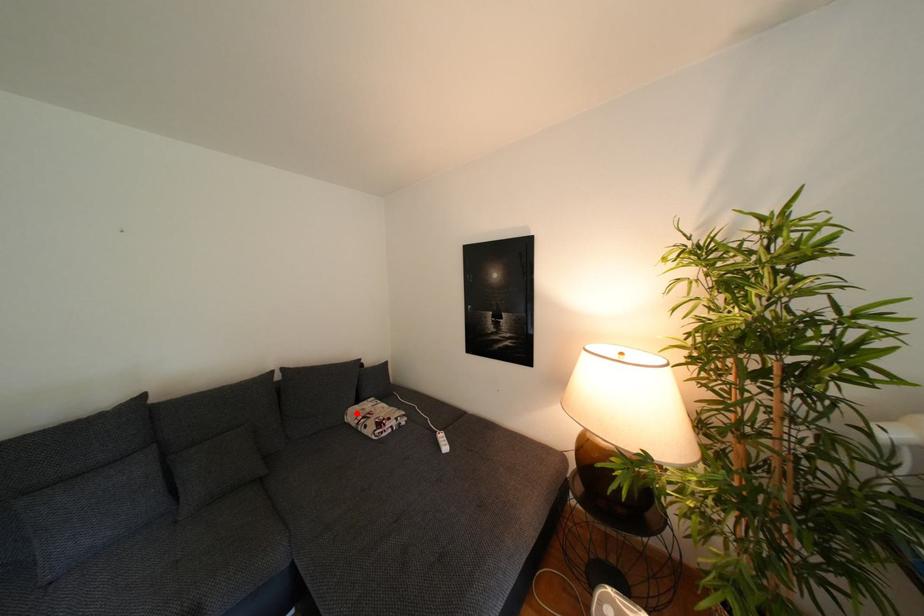
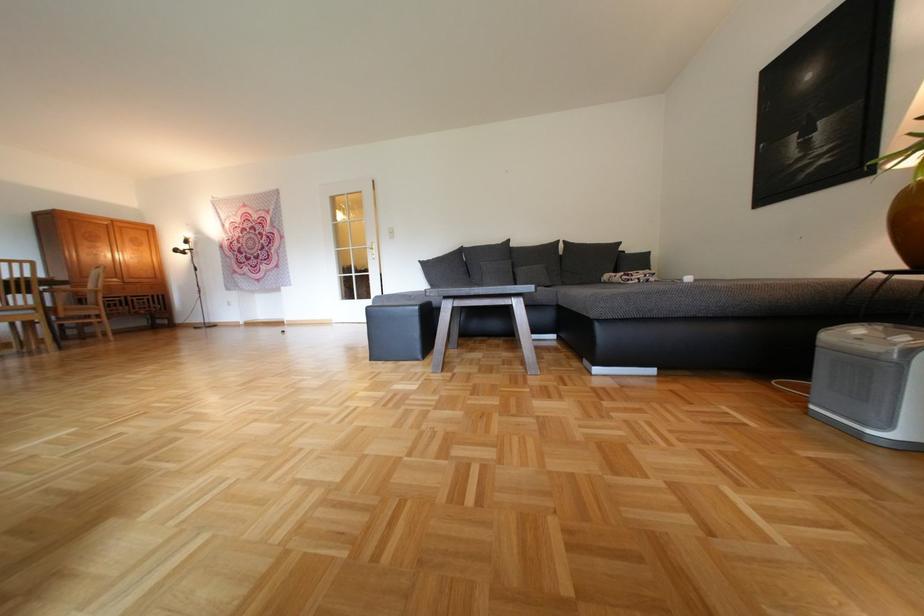
Find the pixel in the second image that matches the highlighted location in the first image.

(614, 276)